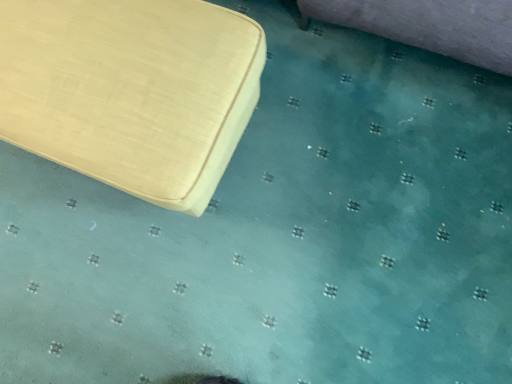
Find the location of a particular element. The width and height of the screenshot is (512, 384). empty space that is ontop of light wood/finely polished table at upper left (from a real-world perspective) is located at coordinates (104, 62).